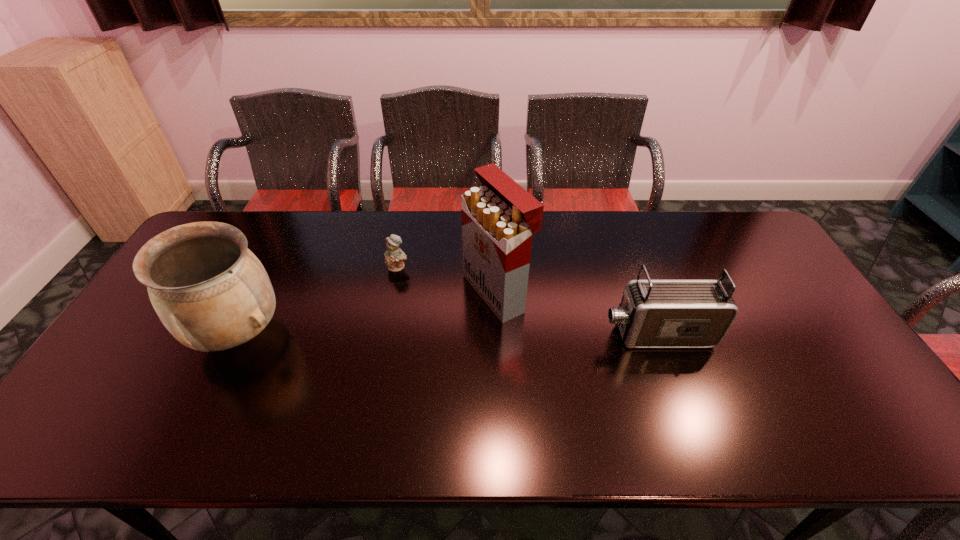
Find the location of `blank region between the tallest object and the rightmost object`. blank region between the tallest object and the rightmost object is located at coordinates (576, 313).

Find the location of a particular element. This screenshot has height=540, width=960. free space between the camcorder and the tallest object is located at coordinates (576, 313).

Locate an element on the screen. This screenshot has height=540, width=960. vacant space in between the third object from right to left and the leftmost object is located at coordinates (318, 300).

What are the coordinates of `free area in between the camcorder and the third shortest object` in the screenshot? It's located at (447, 334).

The height and width of the screenshot is (540, 960). I want to click on free area in between the second tallest object and the shortest object, so click(x=318, y=300).

Identify which object is the closest to the teddy bear. Please provide its 2D coordinates. Your answer should be formatted as a tuple, i.e. [(x, y)], where the tuple contains the x and y coordinates of a point satisfying the conditions above.

[(499, 218)]

Locate an element on the screen. This screenshot has width=960, height=540. object that is the second closest one to the tallest object is located at coordinates (653, 313).

The height and width of the screenshot is (540, 960). In order to click on blank space that satisfies the following two spatial constraints: 1. on the front side of the cigarette case; 2. at the lens of the second shortest object in this screenshot , I will do `click(498, 334)`.

Locate an element on the screen. The width and height of the screenshot is (960, 540). free space that satisfies the following two spatial constraints: 1. on the front side of the rightmost object; 2. at the lens of the second tallest object is located at coordinates (237, 334).

This screenshot has height=540, width=960. Identify the location of vacant space that satisfies the following two spatial constraints: 1. on the back side of the tallest object; 2. on the left side of the urn. (258, 292).